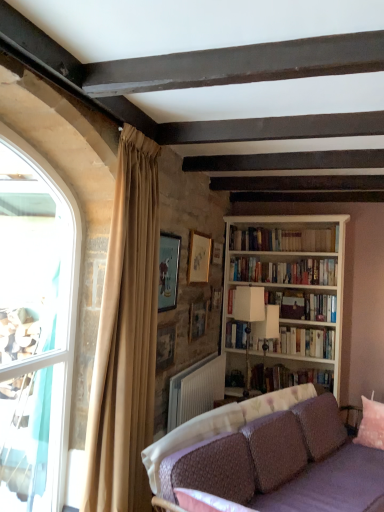
Question: Considering the relative positions of matte wooden picture frame at upper center, the fifth picture frame in the back-to-front sequence, and white matte lamp at center, which is counted as the first lamp, starting from the front, in the image provided, is matte wooden picture frame at upper center, the fifth picture frame in the back-to-front sequence, to the left of white matte lamp at center, which is counted as the first lamp, starting from the front, from the viewer's perspective?

Choices:
 (A) no
 (B) yes

Answer: (B)

Question: Could you tell me if matte wooden picture frame at upper center, which appears as the first picture frame when viewed from the front, is turned towards white matte lamp at center, which is counted as the first lamp, starting from the front?

Choices:
 (A) yes
 (B) no

Answer: (B)

Question: Can you confirm if matte wooden picture frame at upper center, the fifth picture frame in the back-to-front sequence, is smaller than white matte lamp at center, which is counted as the first lamp, starting from the front?

Choices:
 (A) no
 (B) yes

Answer: (B)

Question: Can you confirm if matte wooden picture frame at upper center, which appears as the first picture frame when viewed from the front, is bigger than white matte lamp at center, which is the second lamp in back-to-front order?

Choices:
 (A) yes
 (B) no

Answer: (B)

Question: Does matte wooden picture frame at upper center, the fifth picture frame in the back-to-front sequence, come behind white matte lamp at center, which is the second lamp in back-to-front order?

Choices:
 (A) no
 (B) yes

Answer: (A)

Question: Relative to wooden picture frame at upper center, which is counted as the fourth picture frame, starting from the back, is wooden bookshelf at upper right, which ranks as the first book in top-to-bottom order, in front or behind?

Choices:
 (A) front
 (B) behind

Answer: (B)

Question: From a real-world perspective, is wooden bookshelf at upper right, the 4th book ordered from the bottom, positioned above or below wooden picture frame at upper center, the 2th picture frame from the front?

Choices:
 (A) above
 (B) below

Answer: (A)

Question: Looking at their shapes, would you say wooden bookshelf at upper right, which ranks as the first book in top-to-bottom order, is wider or thinner than wooden picture frame at upper center, the 2th picture frame from the front?

Choices:
 (A) wide
 (B) thin

Answer: (A)

Question: Does point (307, 231) appear closer or farther from the camera than point (167, 343)?

Choices:
 (A) closer
 (B) farther

Answer: (B)

Question: From a real-world perspective, is hardcover books at center, which is counted as the third book, starting from the bottom, positioned above or below wooden picture frame at upper center, the 5th picture frame from the front?

Choices:
 (A) below
 (B) above

Answer: (A)

Question: Is point (253, 275) closer or farther from the camera than point (215, 260)?

Choices:
 (A) closer
 (B) farther

Answer: (A)

Question: Looking at their shapes, would you say hardcover books at center, which is counted as the third book, starting from the bottom, is wider or thinner than wooden picture frame at upper center, the 5th picture frame from the front?

Choices:
 (A) thin
 (B) wide

Answer: (B)

Question: Is hardcover books at center, which is counted as the third book, starting from the bottom, spatially inside wooden picture frame at upper center, the 5th picture frame from the front, or outside of it?

Choices:
 (A) outside
 (B) inside

Answer: (A)

Question: Is hardcover book at center, the first book when ordered from bottom to top, to the left or to the right of wooden picture frame at upper center, which is counted as the fourth picture frame, starting from the back, in the image?

Choices:
 (A) left
 (B) right

Answer: (B)

Question: Looking at the image, does hardcover book at center, which is the 4th book from top to bottom, seem bigger or smaller compared to wooden picture frame at upper center, which is counted as the fourth picture frame, starting from the back?

Choices:
 (A) big
 (B) small

Answer: (A)